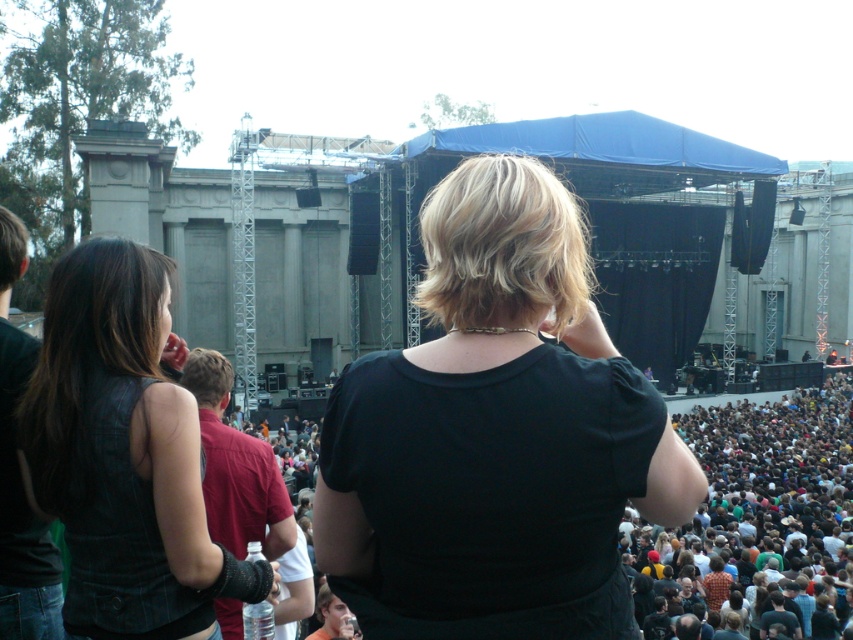
Question: Can you confirm if black matte shirt at center is positioned below dark brown hair at lower right?

Choices:
 (A) yes
 (B) no

Answer: (B)

Question: Is leather vest at left positioned before dark brown hair at lower right?

Choices:
 (A) no
 (B) yes

Answer: (B)

Question: Which object is the closest to the dark brown hair at lower right?

Choices:
 (A) leather vest at left
 (B) black matte shirt at center

Answer: (B)

Question: Which point is farther to the camera?

Choices:
 (A) leather vest at left
 (B) dark brown hair at lower right
 (C) black matte shirt at center

Answer: (B)

Question: Among these objects, which one is farthest from the camera?

Choices:
 (A) black matte shirt at center
 (B) dark brown hair at lower right

Answer: (B)

Question: Can you confirm if black matte shirt at center is positioned above leather vest at left?

Choices:
 (A) no
 (B) yes

Answer: (B)